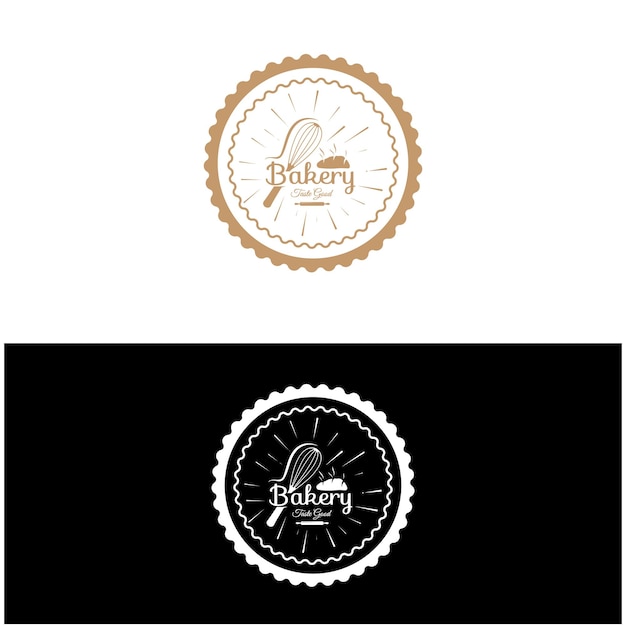
Find the location of a particular element. This screenshot has width=626, height=626. poster is located at coordinates (188, 524).